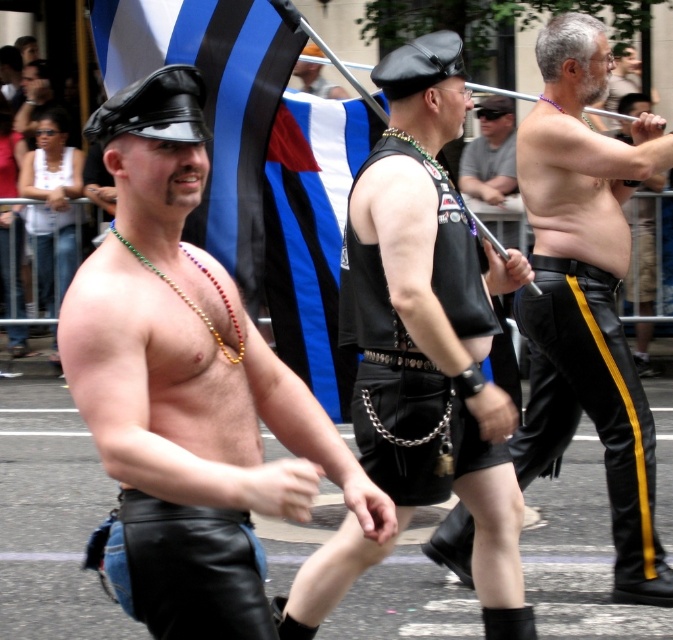
Question: Estimate the real-world distances between objects in this image. Which object is farther from the shiny black leather shorts at center?

Choices:
 (A) matte black vest at center
 (B) black leather vest at center
 (C) black leather pants at center
 (D) black leather hat at upper left

Answer: (A)

Question: Does shiny black leather shorts at center appear on the left side of matte black vest at center?

Choices:
 (A) no
 (B) yes

Answer: (B)

Question: Which of the following is the closest to the observer?

Choices:
 (A) (306, 84)
 (B) (563, 200)
 (C) (212, 294)
 (D) (439, 282)

Answer: (C)

Question: Which of the following is the closest to the observer?

Choices:
 (A) matte black vest at center
 (B) leather cap at center
 (C) black leather hat at upper left
 (D) black leather pants at center

Answer: (C)

Question: Does black leather hat at upper left have a larger size compared to matte black vest at center?

Choices:
 (A) no
 (B) yes

Answer: (A)

Question: Observing the image, what is the correct spatial positioning of shiny black leather shorts at center in reference to blue fabric flag at center?

Choices:
 (A) left
 (B) right

Answer: (A)